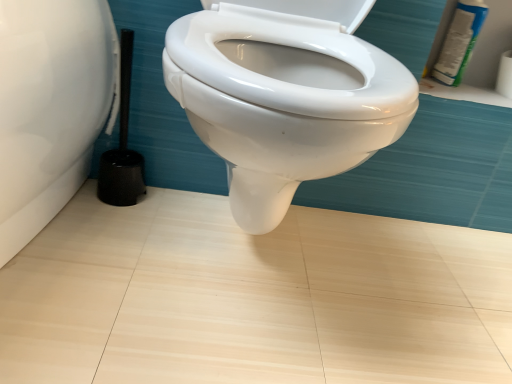
The height and width of the screenshot is (384, 512). Find the location of `unoccupied area in front of black plastic brush at left`. unoccupied area in front of black plastic brush at left is located at coordinates (100, 231).